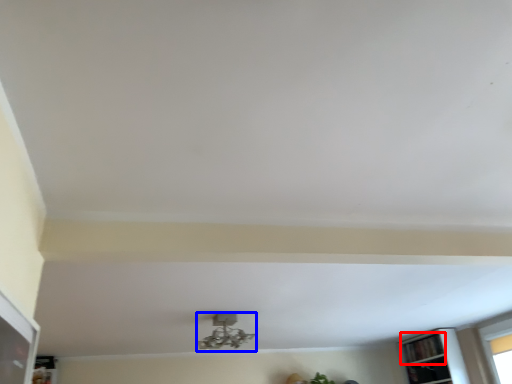
Question: Which object is closer to the camera taking this photo, shelf (highlighted by a red box) or lamp (highlighted by a blue box)?

Choices:
 (A) shelf
 (B) lamp

Answer: (B)